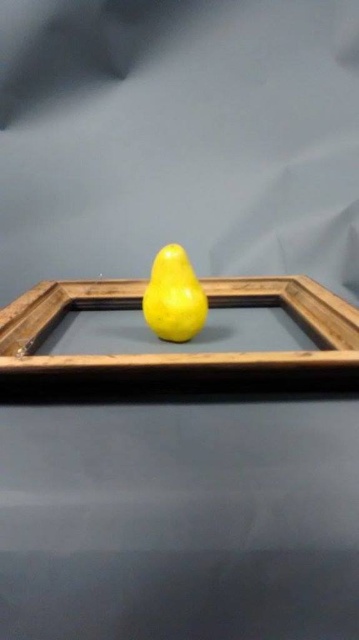
What do you see at coordinates (178, 346) in the screenshot? I see `wooden frame at center` at bounding box center [178, 346].

This screenshot has height=640, width=359. What are the coordinates of `wooden frame at center` in the screenshot? It's located at (178, 346).